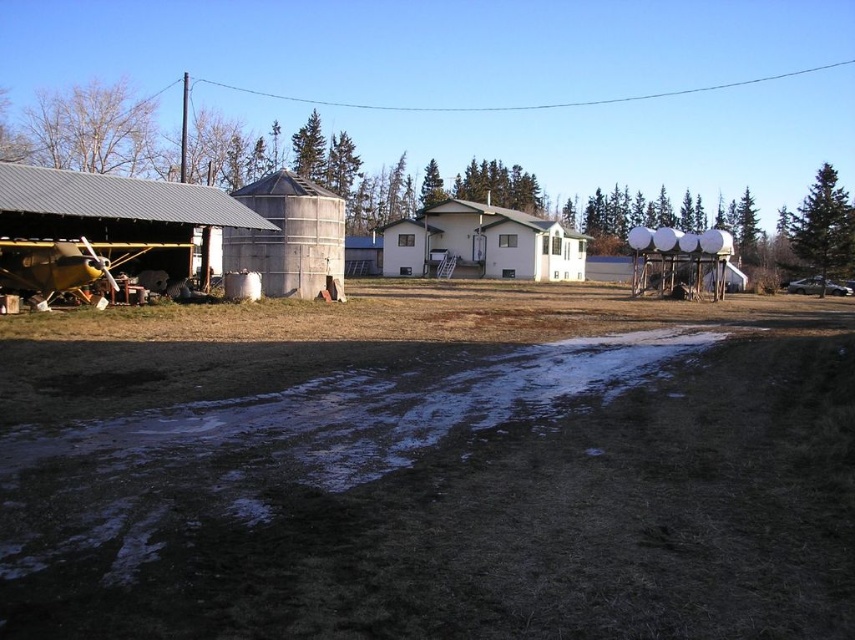
You are a farmer who needs to move a heavy equipment from the brown grass at lower center to the brushed metal barn at left. The equipment requires a path that is at least 6 meters wide to turn around. Based on the scene, can the equipment safely turn around between these two locations?

The distance between the brown grass at lower center and the brushed metal barn at left is 5.84 meters, which is less than the required 6 meters. Therefore, the equipment cannot safely turn around in this space.

You are standing at the edge of the brown grassy field at lower center and want to walk to the white matte house at center. Which direction should you head to reach the house?

The brown grassy field at lower center is to the left of the white matte house at center, so you should head to the right to reach the house.